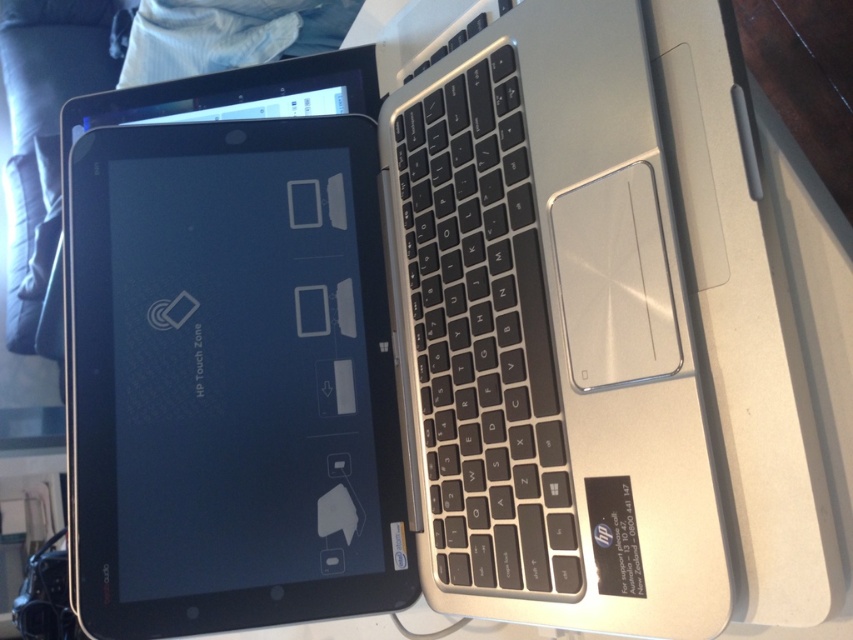
Does black glossy tablet at center have a greater height compared to black matte keyboard at center?

Correct, black glossy tablet at center is much taller as black matte keyboard at center.

Is black glossy tablet at center wider than black matte keyboard at center?

Correct, the width of black glossy tablet at center exceeds that of black matte keyboard at center.

Where is `black glossy tablet at center`? black glossy tablet at center is located at coordinates (231, 380).